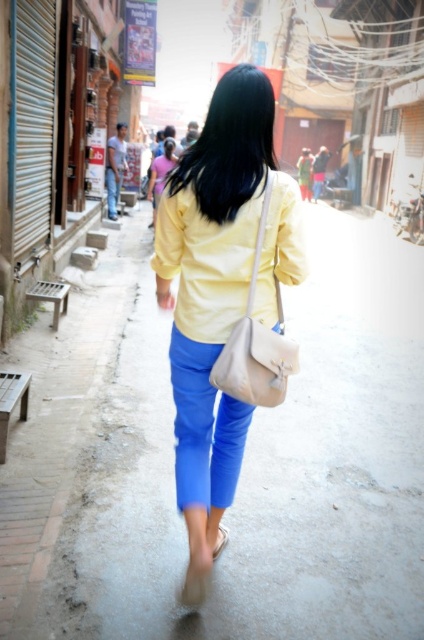
You are a delivery drone flying above the narrow street. You need to land on the dull concrete pavement at center. What are the coordinates where you should land?

The coordinates for the dull concrete pavement at center are at point (265, 474).

You are standing behind the person in the image and want to walk towards the two points marked in the scene. Which point, point (x=286, y=349) or point (x=170, y=154), will you reach first?

Point (x=286, y=349) is closer to the viewer than point (x=170, y=154), so you will reach point (x=286, y=349) first.

You are a photographer trying to capture the person in the image. You want to focus on the beige leather shoulder bag at center and the black silky hair at upper center. Which object should you adjust your camera to focus on first if you want to ensure both are in the frame?

The beige leather shoulder bag at center is in front of the black silky hair at upper center, so you should focus on the beige leather shoulder bag at center first to ensure both are in the frame.